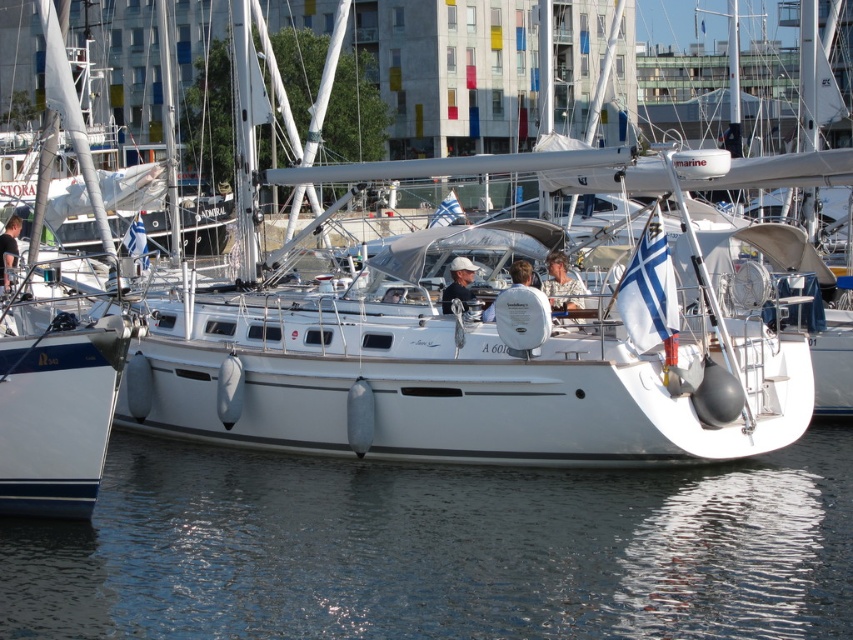
Question: Which point is farther from the camera taking this photo?

Choices:
 (A) (57, 83)
 (B) (843, 566)

Answer: (A)

Question: Which object appears closest to the camera in this image?

Choices:
 (A) white matte sailboat at center
 (B) transparent water at lower center

Answer: (B)

Question: Among these points, which one is nearest to the camera?

Choices:
 (A) (592, 422)
 (B) (514, 561)

Answer: (B)

Question: Can you confirm if transparent water at lower center is positioned below white matte sailboat at center?

Choices:
 (A) yes
 (B) no

Answer: (A)

Question: Is transparent water at lower center wider than white matte sailboat at center?

Choices:
 (A) yes
 (B) no

Answer: (B)

Question: Can you confirm if transparent water at lower center is wider than white matte sailboat at center?

Choices:
 (A) no
 (B) yes

Answer: (A)